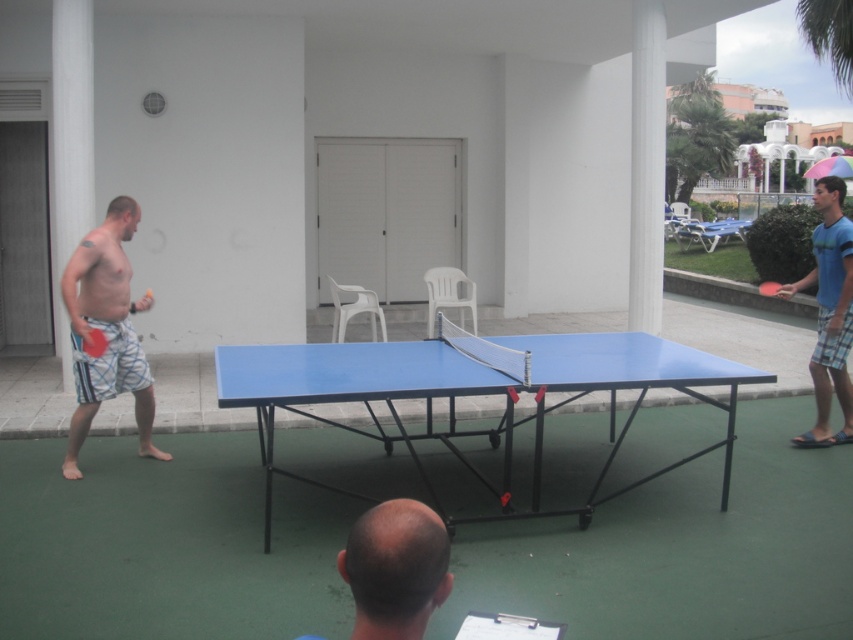
You are setting up a picnic area and need to place both the blue plastic table at center and the blue plastic table tennis table at center. Given their sizes, which one should you place first to ensure they fit properly?

The blue plastic table at center is bigger than the blue plastic table tennis table at center, so you should place the blue plastic table at center first to accommodate its larger size before positioning the smaller table tennis table.

You are standing at the center of the blue table tennis table and want to move to the matte blue shorts at left. In which direction should you move relative to the table?

You should move to the left relative to the table to reach the matte blue shorts at left, as their 2D location is at point (106, 330).

You are standing at the point marked as point (535,492) in the image. The table tennis table is 2.74 meters long. Can you determine if the entire length of the table tennis table fits within your field of view?

The distance between you and point (535,492) is 4.23 meters. Since the table is 2.74 meters long, and assuming the table is positioned straight ahead, the entire length of the table tennis table would likely fit within your field of view as the distance is greater than half the table length.